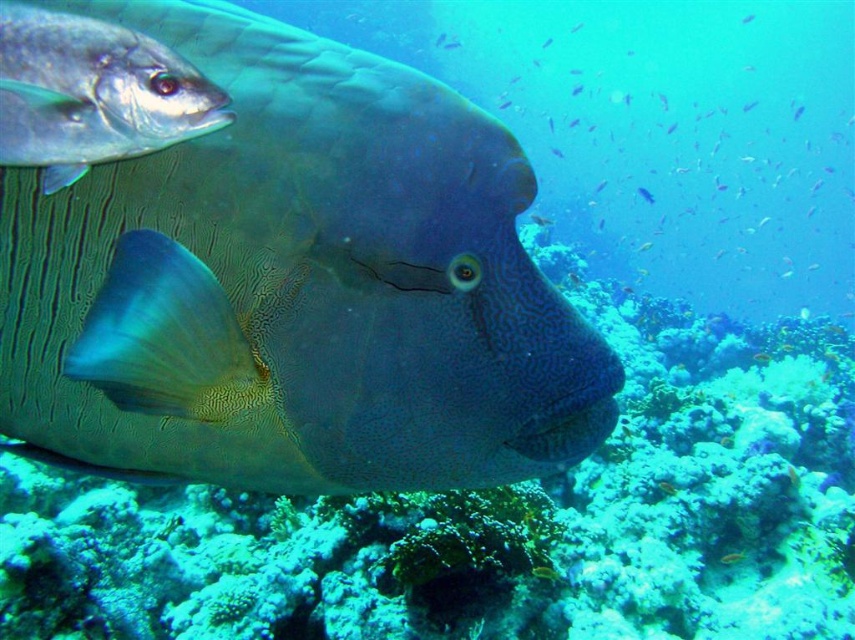
You are a marine biologist observing the underwater scene. You notice two points in the image labeled as point 1 at coordinates point (711, 579) and point 2 at coordinates point (734, 561). Which point is closer to the camera?

Point (711, 579) is closer to the camera than point (734, 561).

You are a marine biologist observing an underwater scene. You notice two fish at the center of the image, a shiny yellow fish at center and a satin blue fish at center. Which one is smaller?

The shiny yellow fish at center is smaller than the satin blue fish at center.

You are a scuba diver with a 3.5 feet long underwater camera. You want to take a photo of both the textured coral reef at center and the shiny yellow fish at center in the same frame. Can you position yourself so that both fit within the camera lens without moving either object?

The distance between the textured coral reef at center and the shiny yellow fish at center is 3.39 feet, which is less than the camera length of 3.5 feet. Therefore, you can position yourself so that both fit within the camera lens without moving either object.